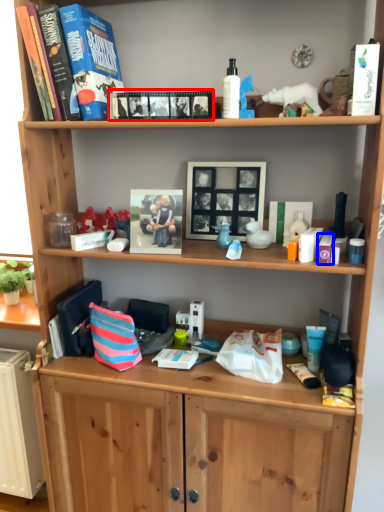
Question: Which of the following is the closest to the observer, book (highlighted by a red box) or toiletry (highlighted by a blue box)?

Choices:
 (A) book
 (B) toiletry

Answer: (A)